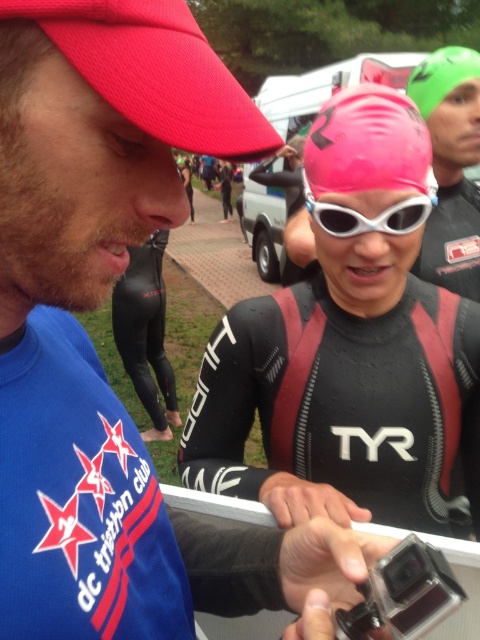
You are a photographer at the triathlon event. You need to capture a photo where both the pink matte swim cap at center and the green matte swim cap at upper right are visible. Which swim cap should you focus on first to ensure both are in frame?

The pink matte swim cap at center is not as tall as the green matte swim cap at upper right, so you should focus on the green matte swim cap at upper right first to ensure both are in frame.